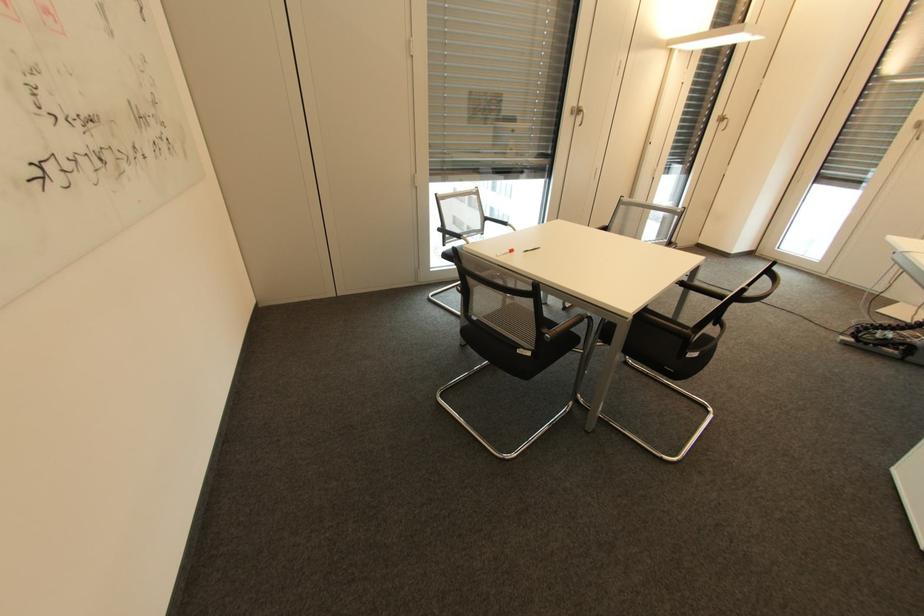
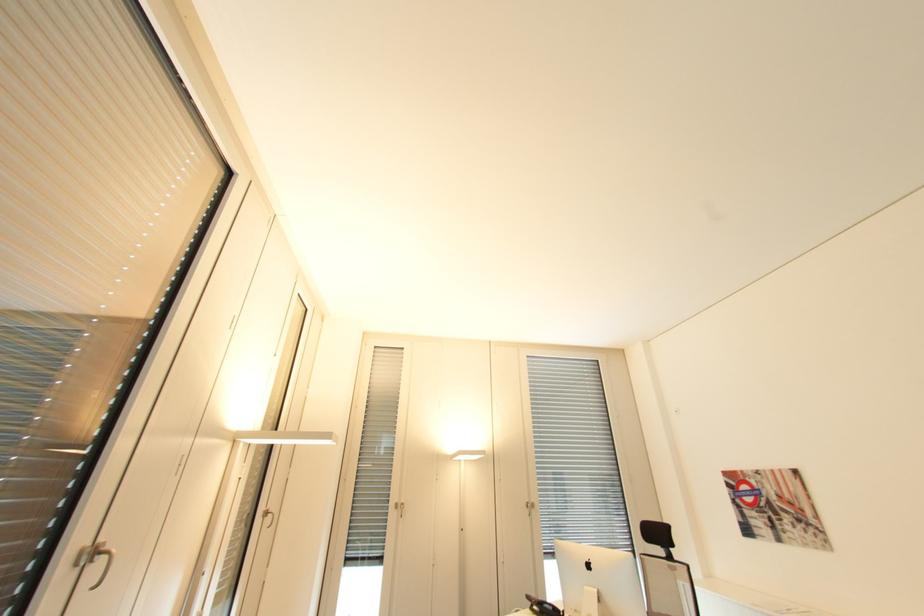
Locate, in the second image, the point that corresponds to point (723, 116) in the first image.

(270, 511)